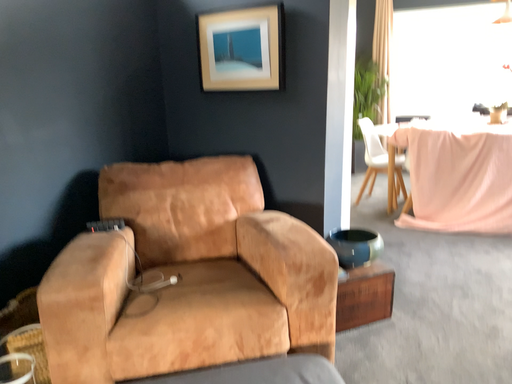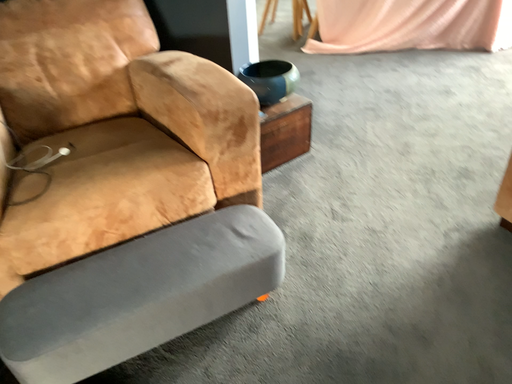
Question: Which way did the camera rotate in the video?

Choices:
 (A) rotated downward
 (B) rotated upward

Answer: (A)